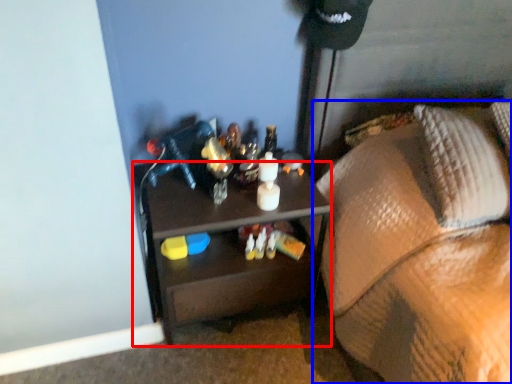
Question: Which of the following is the closest to the observer, desk (highlighted by a red box) or furniture (highlighted by a blue box)?

Choices:
 (A) desk
 (B) furniture

Answer: (B)